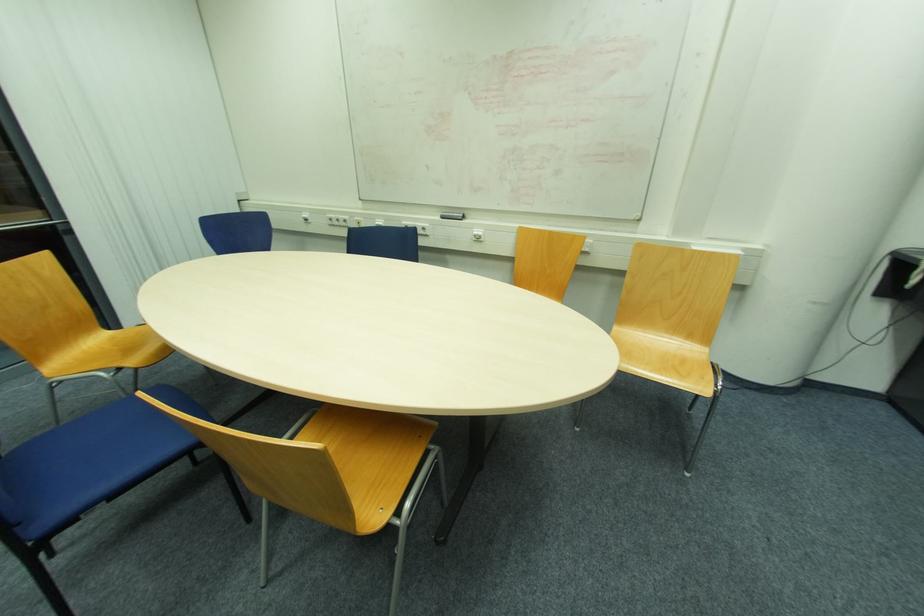
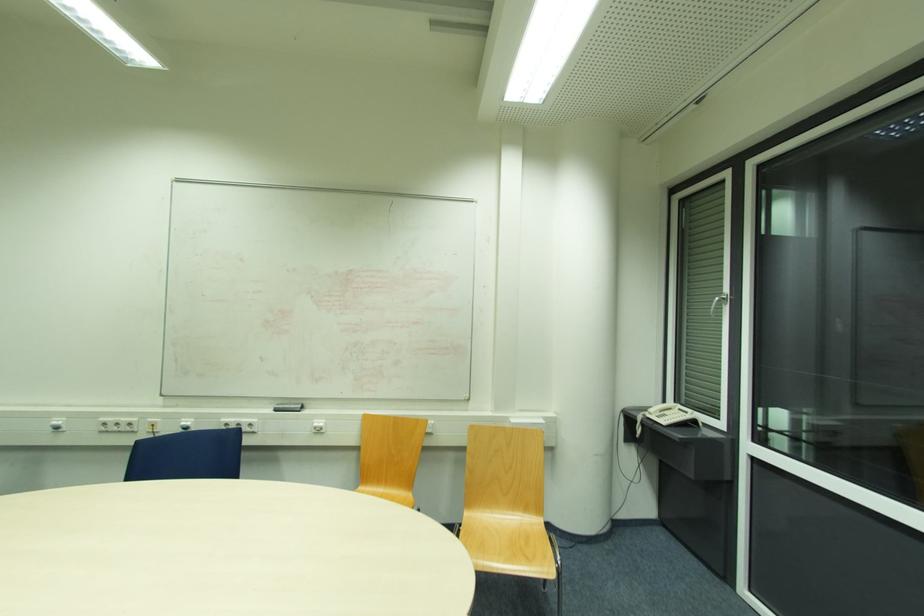
Where in the second image is the point corresponding to pixel 444 217 from the first image?

(276, 411)